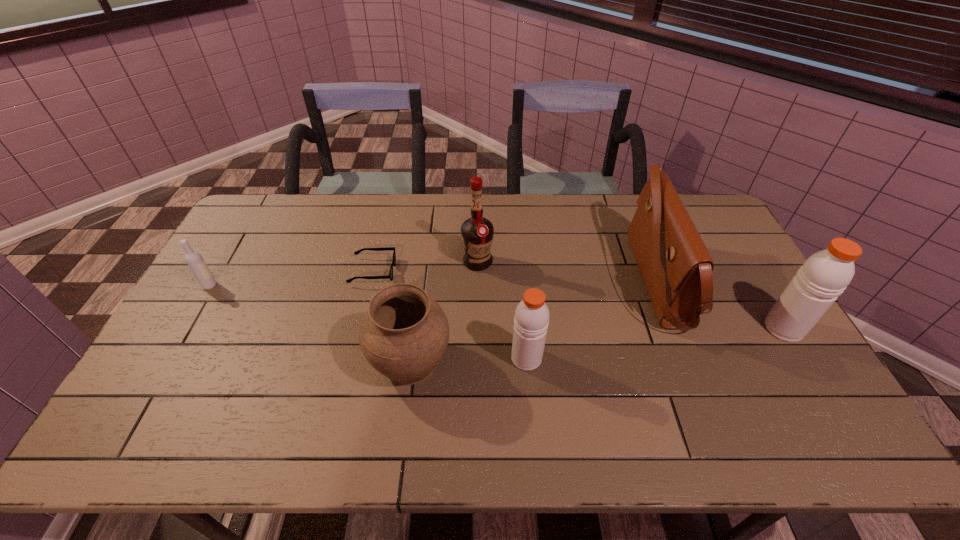
Where is `object present at the near edge`? This screenshot has height=540, width=960. object present at the near edge is located at coordinates [x=404, y=334].

At what (x,y) coordinates should I click in order to perform the action: click on object at the left edge. Please return your answer as a coordinate pair (x, y). Image resolution: width=960 pixels, height=540 pixels. Looking at the image, I should click on (195, 261).

In order to click on object present at the right edge in this screenshot , I will do `click(824, 276)`.

Image resolution: width=960 pixels, height=540 pixels. In the image, there is a desktop. What are the coordinates of `vacant region at the far edge` in the screenshot? It's located at (461, 227).

At what (x,y) coordinates should I click in order to perform the action: click on free location at the near edge. Please return your answer as a coordinate pair (x, y). This screenshot has height=540, width=960. Looking at the image, I should click on (226, 394).

The height and width of the screenshot is (540, 960). In the image, there is a desktop. Find the location of `free region at the left edge`. free region at the left edge is located at coordinates (216, 314).

You are a GUI agent. You are given a task and a screenshot of the screen. Output one action in this format:
    pyautogui.click(x=<x>, y=<y>)
    Task: Click on the vacant point at the right edge
    The height and width of the screenshot is (540, 960).
    Given the screenshot: What is the action you would take?
    pyautogui.click(x=736, y=268)

Find the location of a particular element. The image size is (960, 540). free region at the far left corner of the desktop is located at coordinates (275, 194).

In the image, there is a desktop. In order to click on vacant space at the near left corner in this screenshot , I will do `click(177, 401)`.

The width and height of the screenshot is (960, 540). I want to click on unoccupied area between the satchel and the second shortest object, so click(434, 284).